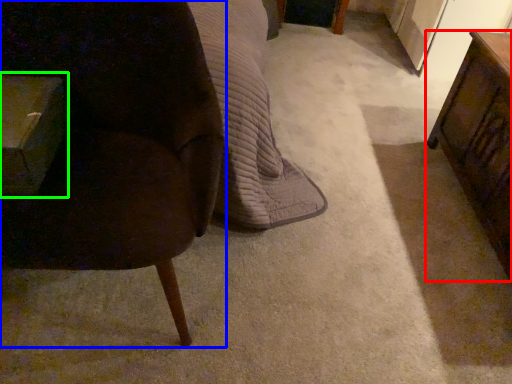
Question: Which object is the farthest from table (highlighted by a red box)? Choose among these: chair (highlighted by a blue box) or table (highlighted by a green box).

Choices:
 (A) chair
 (B) table

Answer: (B)